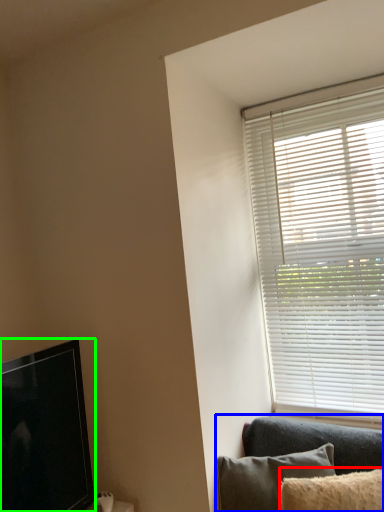
Question: Based on their relative distances, which object is farther from pillow (highlighted by a red box)? Choose from studio couch (highlighted by a blue box) and television (highlighted by a green box).

Choices:
 (A) studio couch
 (B) television

Answer: (B)